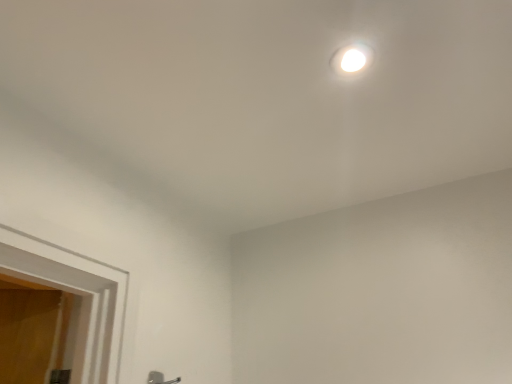
Question: Is point (155, 375) positioned closer to the camera than point (360, 46)?

Choices:
 (A) farther
 (B) closer

Answer: (A)

Question: In terms of size, does satin nickel door handle at lower center appear bigger or smaller than white glossy droplight at upper center?

Choices:
 (A) small
 (B) big

Answer: (B)

Question: From the image's perspective, is satin nickel door handle at lower center above or below white glossy droplight at upper center?

Choices:
 (A) below
 (B) above

Answer: (A)

Question: Is white glossy droplight at upper center spatially inside satin nickel door handle at lower center, or outside of it?

Choices:
 (A) inside
 (B) outside

Answer: (B)

Question: In the image, is white glossy droplight at upper center positioned in front of or behind satin nickel door handle at lower center?

Choices:
 (A) front
 (B) behind

Answer: (A)

Question: Considering the positions of white glossy droplight at upper center and satin nickel door handle at lower center in the image, is white glossy droplight at upper center taller or shorter than satin nickel door handle at lower center?

Choices:
 (A) tall
 (B) short

Answer: (B)

Question: Does point (356, 59) appear closer or farther from the camera than point (178, 382)?

Choices:
 (A) farther
 (B) closer

Answer: (B)